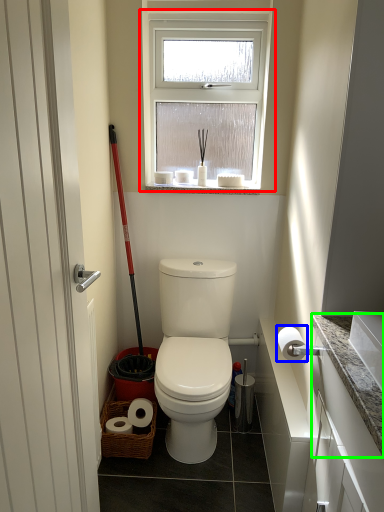
Question: Estimate the real-world distances between objects in this image. Which object is farther from window (highlighted by a red box), toilet paper (highlighted by a blue box) or counter top (highlighted by a green box)?

Choices:
 (A) toilet paper
 (B) counter top

Answer: (B)